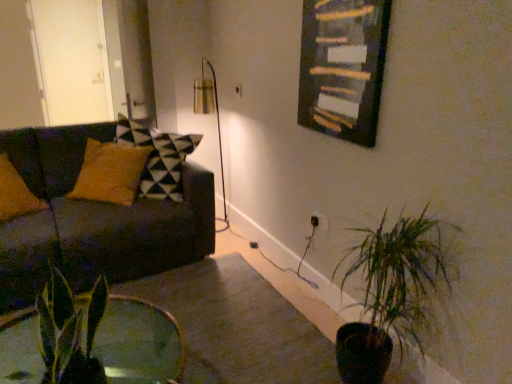
I want to click on free region under wooden frame at upper center (from a real-world perspective), so [x=313, y=296].